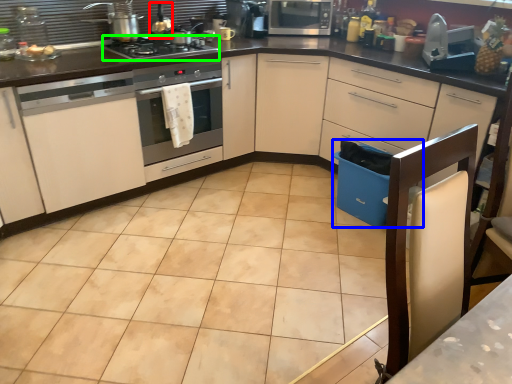
Question: Which object is the closest to the appliance (highlighted by a red box)? Choose among these: dish washer (highlighted by a blue box) or gas stove (highlighted by a green box).

Choices:
 (A) dish washer
 (B) gas stove

Answer: (B)